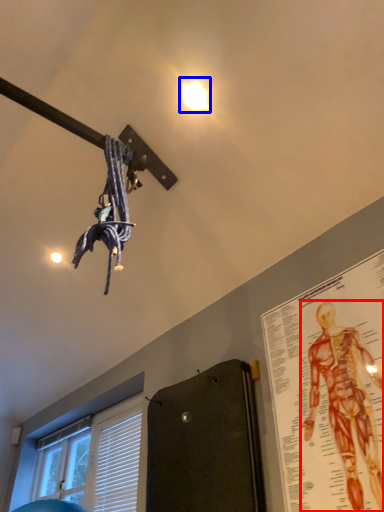
Question: Which of the following is the closest to the observer, person (highlighted by a red box) or droplight (highlighted by a blue box)?

Choices:
 (A) person
 (B) droplight

Answer: (A)